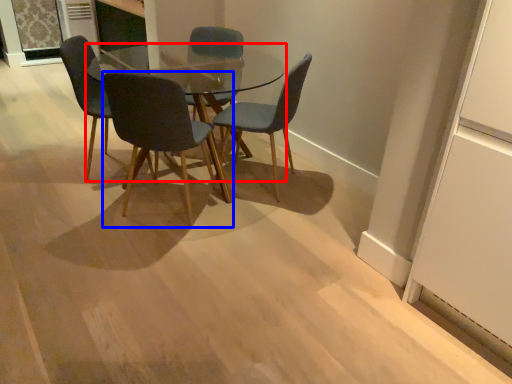
Question: Among these objects, which one is farthest to the camera, coffee table (highlighted by a red box) or chair (highlighted by a blue box)?

Choices:
 (A) coffee table
 (B) chair

Answer: (A)